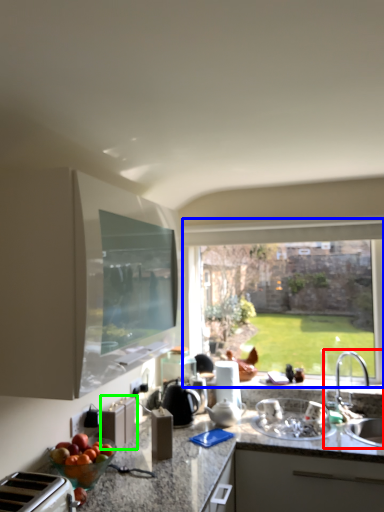
Question: Estimate the real-world distances between objects in this image. Which object is closer to sink (highlighted by a red box), window (highlighted by a blue box) or cabinetry (highlighted by a green box)?

Choices:
 (A) window
 (B) cabinetry

Answer: (A)